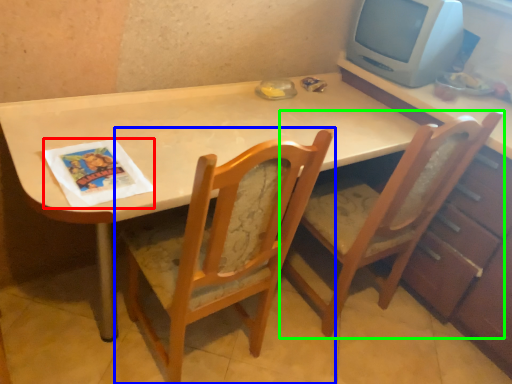
Question: Which object is positioned farthest from magazine (highlighted by a red box)? Select from chair (highlighted by a blue box) and chair (highlighted by a green box).

Choices:
 (A) chair
 (B) chair

Answer: (B)